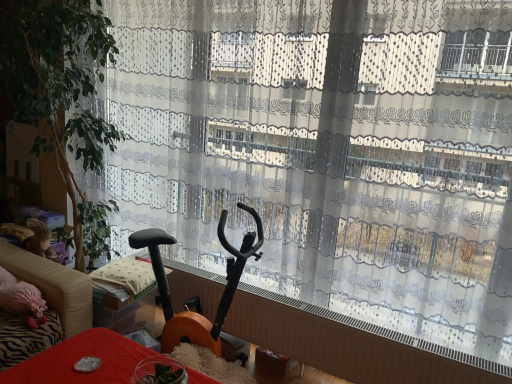
Question: From the image's perspective, is black plastic exercise bike at left, marked as the 2th furniture in a front-to-back arrangement, beneath green leafy plant at left?

Choices:
 (A) no
 (B) yes

Answer: (B)

Question: Is black plastic exercise bike at left, which appears as the first furniture when viewed from the top, at the right side of green leafy plant at left?

Choices:
 (A) yes
 (B) no

Answer: (A)

Question: Is black plastic exercise bike at left, which appears as the first furniture when viewed from the top, to the left of green leafy plant at left from the viewer's perspective?

Choices:
 (A) yes
 (B) no

Answer: (B)

Question: From the image's perspective, does black plastic exercise bike at left, which appears as the 2th furniture when ordered from the bottom, appear higher than green leafy plant at left?

Choices:
 (A) yes
 (B) no

Answer: (B)

Question: From a real-world perspective, is black plastic exercise bike at left, marked as the 2th furniture in a front-to-back arrangement, physically below green leafy plant at left?

Choices:
 (A) yes
 (B) no

Answer: (A)

Question: From a real-world perspective, is black plastic exercise bike at left, which is the 1th furniture from back to front, physically above green leafy plant at left?

Choices:
 (A) no
 (B) yes

Answer: (A)

Question: Is the depth of green leafy plant at left greater than that of black plastic exercise bike at left, which is the 1th furniture from back to front?

Choices:
 (A) no
 (B) yes

Answer: (A)

Question: Considering the relative sizes of green leafy plant at left and black plastic exercise bike at left, marked as the 2th furniture in a front-to-back arrangement, in the image provided, is green leafy plant at left thinner than black plastic exercise bike at left, marked as the 2th furniture in a front-to-back arrangement,?

Choices:
 (A) no
 (B) yes

Answer: (A)

Question: Would you say black plastic exercise bike at left, which appears as the first furniture when viewed from the top, is part of green leafy plant at left's contents?

Choices:
 (A) yes
 (B) no

Answer: (A)

Question: Is green leafy plant at left shorter than black plastic exercise bike at left, which appears as the 2th furniture when ordered from the bottom?

Choices:
 (A) no
 (B) yes

Answer: (A)

Question: Is green leafy plant at left not near black plastic exercise bike at left, which appears as the 2th furniture when ordered from the bottom?

Choices:
 (A) no
 (B) yes

Answer: (A)

Question: Is green leafy plant at left aimed at black plastic exercise bike at left, which appears as the first furniture when viewed from the top?

Choices:
 (A) no
 (B) yes

Answer: (A)

Question: Considering the relative positions of translucent glass bowl at lower center, the first furniture in the front-to-back sequence, and beige fabric couch at left in the image provided, is translucent glass bowl at lower center, the first furniture in the front-to-back sequence, to the right of beige fabric couch at left from the viewer's perspective?

Choices:
 (A) yes
 (B) no

Answer: (A)